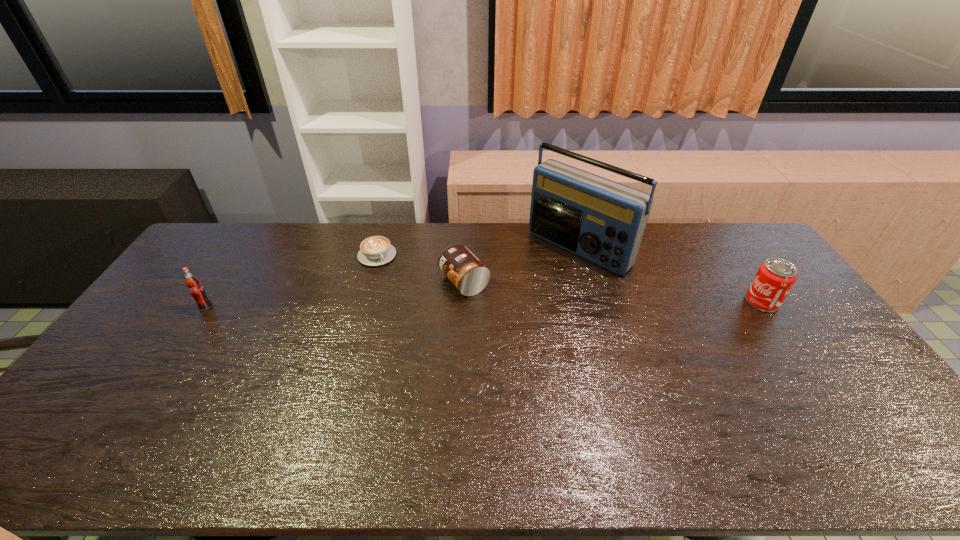
Where is `blank region between the cappuccino and the leftmost object`? The height and width of the screenshot is (540, 960). blank region between the cappuccino and the leftmost object is located at coordinates (291, 281).

What are the coordinates of `free space between the leftmost object and the fourth object from right to left` in the screenshot? It's located at (291, 281).

Image resolution: width=960 pixels, height=540 pixels. I want to click on free space between the fourth object from right to left and the tallest object, so click(478, 252).

The width and height of the screenshot is (960, 540). Identify the location of free point between the fourth tallest object and the soda bottle. (335, 294).

This screenshot has height=540, width=960. I want to click on empty location between the second object from right to left and the right can, so click(x=670, y=275).

Locate an element on the screen. Image resolution: width=960 pixels, height=540 pixels. blank region between the radio receiver and the cappuccino is located at coordinates (478, 252).

Find the location of a particular element. The width and height of the screenshot is (960, 540). vacant area that lies between the tallest object and the soda bottle is located at coordinates (393, 278).

Identify the location of unoccupied position between the soda bottle and the shortest object. This screenshot has height=540, width=960. (291, 281).

Identify the location of vacant point located between the taller can and the shortest object. (569, 279).

Locate an element on the screen. The height and width of the screenshot is (540, 960). object that is the third closest to the rightmost object is located at coordinates (377, 250).